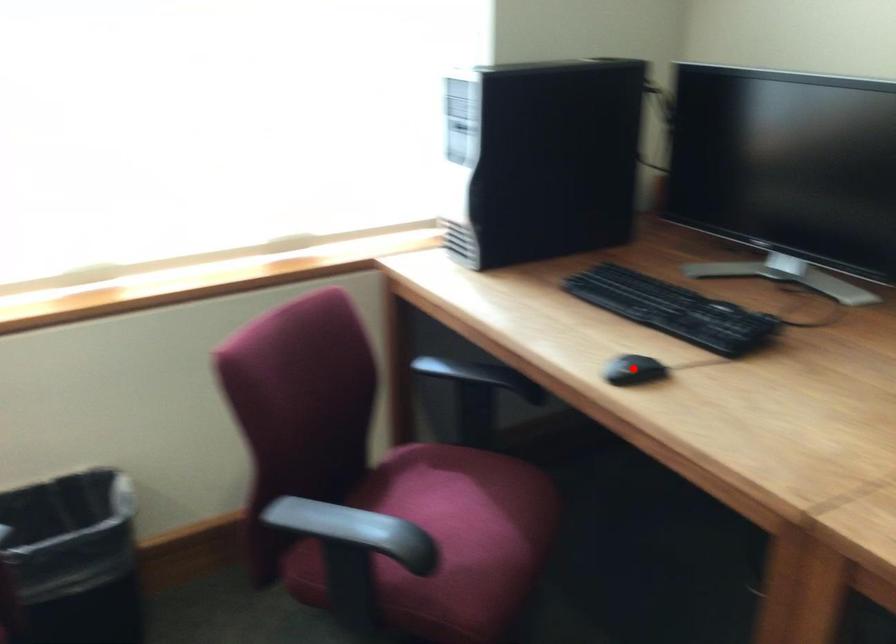
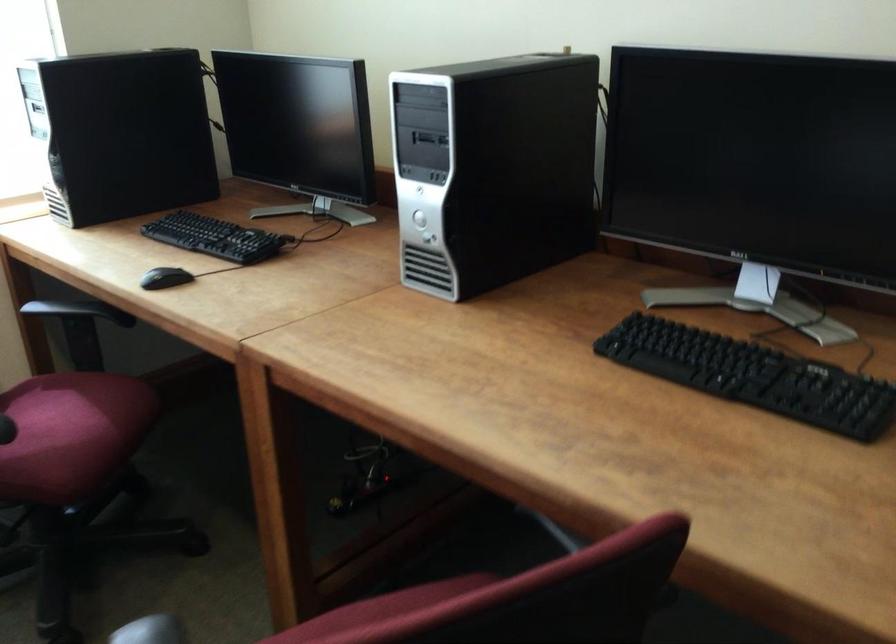
Question: I am providing you with two images of the same scene from different viewpoints. A red point is shown in image1. For the corresponding object point in image2, is it positioned nearer or farther from the camera?

Choices:
 (A) Nearer
 (B) Farther

Answer: (B)